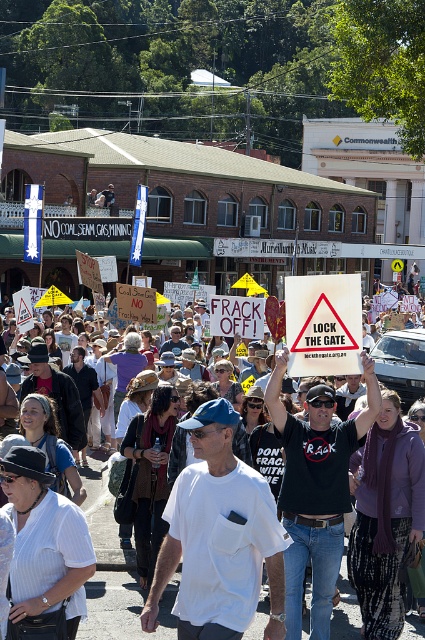
How far apart are white cotton shirt at center and white paper placard at center?

white cotton shirt at center and white paper placard at center are 11.17 feet apart from each other.

Is white cotton shirt at center smaller than white paper placard at center?

Indeed, white cotton shirt at center has a smaller size compared to white paper placard at center.

Measure the distance between white cotton shirt at center and camera.

white cotton shirt at center is 34.25 feet from camera.

I want to click on white cotton shirt at center, so click(115, 572).

Is black cotton t-shirt at center shorter than white paper placard at center?

No, black cotton t-shirt at center is not shorter than white paper placard at center.

This screenshot has height=640, width=425. Find the location of `black cotton t-shirt at center`. black cotton t-shirt at center is located at coordinates (316, 492).

Which is in front, point (362, 433) or point (99, 630)?

Point (362, 433) is more forward.

Does black cotton t-shirt at center have a greater height compared to white cotton shirt at center?

Yes.

You are a GUI agent. You are given a task and a screenshot of the screen. Output one action in this format:
    pyautogui.click(x=<x>, y=<y>)
    Task: Click on the black cotton t-shirt at center
    This screenshot has height=640, width=425.
    Given the screenshot: What is the action you would take?
    pyautogui.click(x=316, y=492)

Where is `black cotton t-shirt at center`? The image size is (425, 640). black cotton t-shirt at center is located at coordinates (316, 492).